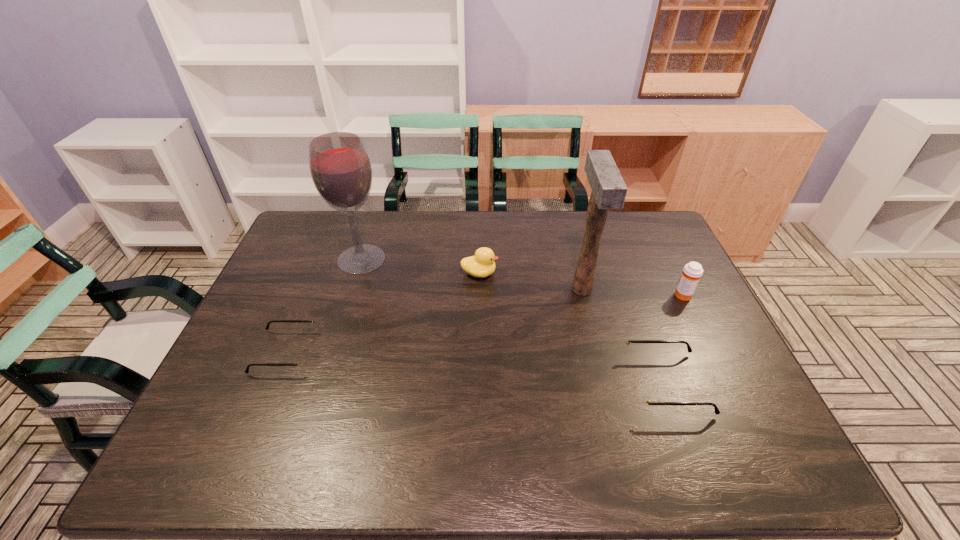
Where is `object that is at the left edge`? This screenshot has height=540, width=960. object that is at the left edge is located at coordinates (303, 360).

In order to click on spectacles present at the right edge in this screenshot , I will do `click(641, 398)`.

Locate an element on the screen. This screenshot has width=960, height=540. medicine that is at the right edge is located at coordinates (692, 272).

In order to click on object that is positioned at the near right corner in this screenshot , I will do `click(641, 398)`.

Find the location of a particular element. free space at the far edge of the desktop is located at coordinates (551, 212).

In the image, there is a desktop. Where is `vacant space at the near edge`? vacant space at the near edge is located at coordinates (479, 410).

The image size is (960, 540). Identify the location of free space at the left edge. (274, 268).

The image size is (960, 540). Find the location of `vacant space at the right edge of the desktop`. vacant space at the right edge of the desktop is located at coordinates (745, 388).

The image size is (960, 540). I want to click on free location at the far left corner of the desktop, so click(313, 238).

This screenshot has height=540, width=960. I want to click on vacant area at the far right corner, so click(x=643, y=217).